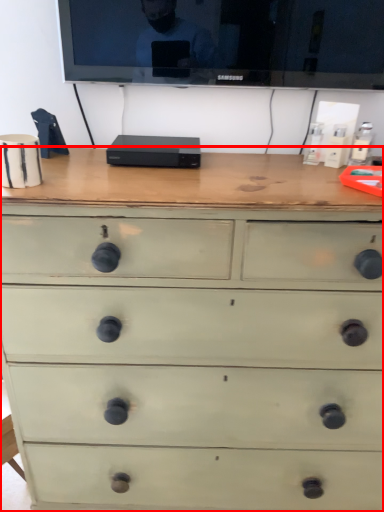
Question: Observing the image, what is the correct spatial positioning of chest of drawers (annotated by the red box) in reference to television?

Choices:
 (A) left
 (B) right

Answer: (A)